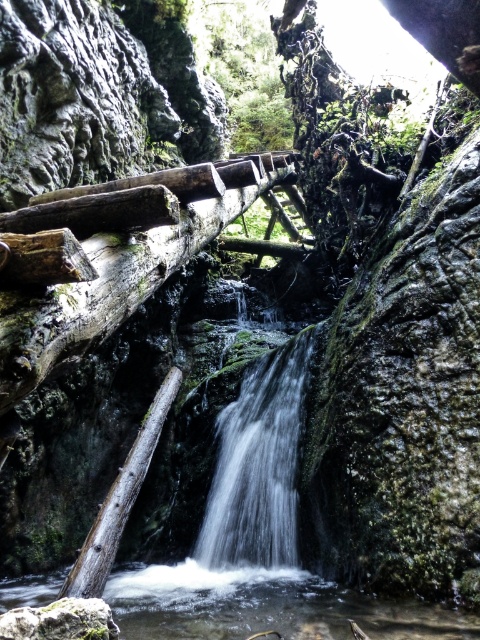
Is clear water at center to the left of green leafy tree at upper center from the viewer's perspective?

Yes, clear water at center is to the left of green leafy tree at upper center.

Which is behind, point (319, 605) or point (228, 36)?

The point (228, 36) is behind.

This screenshot has width=480, height=640. What do you see at coordinates (264, 605) in the screenshot? I see `clear water at center` at bounding box center [264, 605].

You are a GUI agent. You are given a task and a screenshot of the screen. Output one action in this format:
    pyautogui.click(x=<x>, y=<y>)
    Task: Click on the clear water at center
    
    Given the screenshot: What is the action you would take?
    pyautogui.click(x=264, y=605)

Who is shorter, clear water at center or white frothy water at center?

clear water at center is shorter.

What do you see at coordinates (264, 605) in the screenshot? I see `clear water at center` at bounding box center [264, 605].

Is point (236, 595) less distant than point (224, 534)?

Yes, it is in front of point (224, 534).

Locate an element on the screen. The image size is (480, 640). clear water at center is located at coordinates pos(264,605).

Who is higher up, weathered wood bridge at center or green leafy tree at upper center?

green leafy tree at upper center is higher up.

Does weathered wood bridge at center lie in front of green leafy tree at upper center?

That is True.

Between point (90, 241) and point (232, 58), which one is positioned behind?

Positioned behind is point (232, 58).

Identify the location of weathered wood bridge at center. (115, 282).